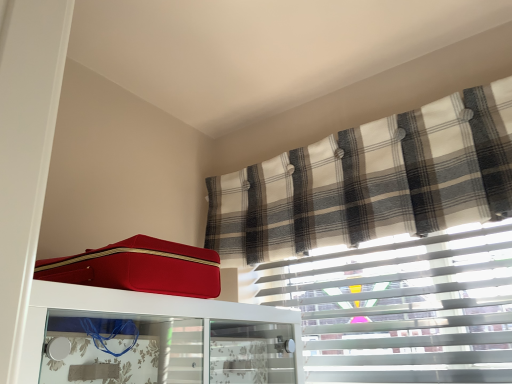
I want to click on empty space that is ontop of plaid fabric curtain at upper right (from a real-world perspective), so click(x=359, y=142).